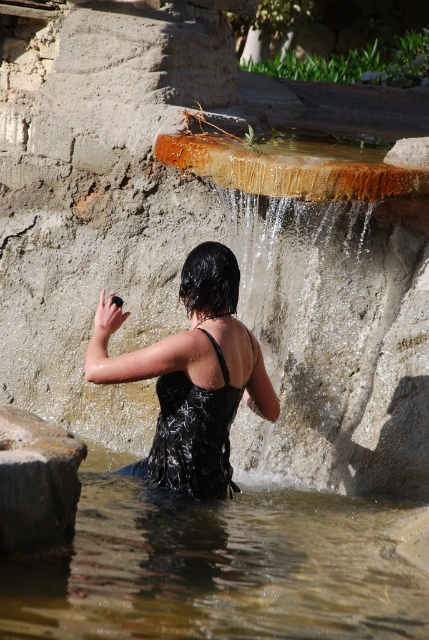
In the scene shown: Is clear water at center thinner than wet black swimsuit at center?

No, clear water at center is not thinner than wet black swimsuit at center.

In the scene shown: Is clear water at center smaller than wet black swimsuit at center?

Incorrect, clear water at center is not smaller in size than wet black swimsuit at center.

The width and height of the screenshot is (429, 640). I want to click on clear water at center, so click(x=220, y=568).

Find the location of a particular element. clear water at center is located at coordinates (220, 568).

Who is more distant from viewer, (233, 336) or (36, 429)?

Positioned behind is point (233, 336).

This screenshot has width=429, height=640. Describe the element at coordinates (192, 378) in the screenshot. I see `wet black swimsuit at center` at that location.

The height and width of the screenshot is (640, 429). In order to click on wet black swimsuit at center in this screenshot , I will do pos(192,378).

What do you see at coordinates (220, 568) in the screenshot? This screenshot has width=429, height=640. I see `clear water at center` at bounding box center [220, 568].

Is point (260, 552) farther from viewer compared to point (59, 541)?

Yes, point (260, 552) is farther from viewer.

At what (x,y) coordinates should I click in order to perform the action: click on clear water at center. Please return your answer as a coordinate pair (x, y). Looking at the image, I should click on (220, 568).